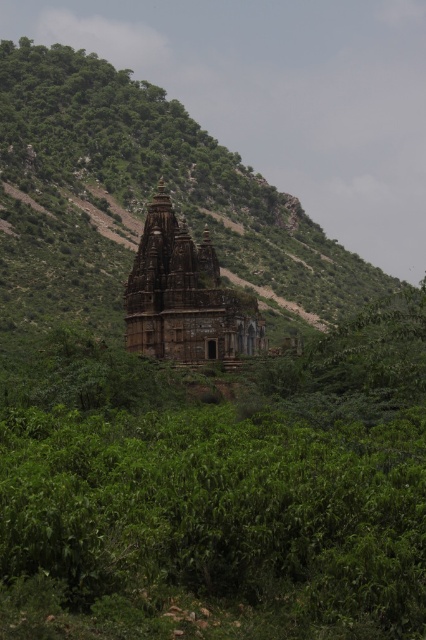
You are a hiker who wants to take a photo of the brown stone hindu temple at center without the green leafy mountain at center blocking the view. Is it possible to find a position where the temple is fully visible and the mountain is not in the frame?

The green leafy mountain at center is much taller than the brown stone hindu temple at center, so if you position yourself lower and farther away, you might angle the camera downward to capture the temple while avoiding the mountain.

You are a hiker who has just reached the top of the mountain and sees the green leafy mountain at center and the brown stone hindu temple at center. Which object is higher in elevation?

The green leafy mountain at center is above the brown stone hindu temple at center, so the green leafy mountain at center is higher in elevation.